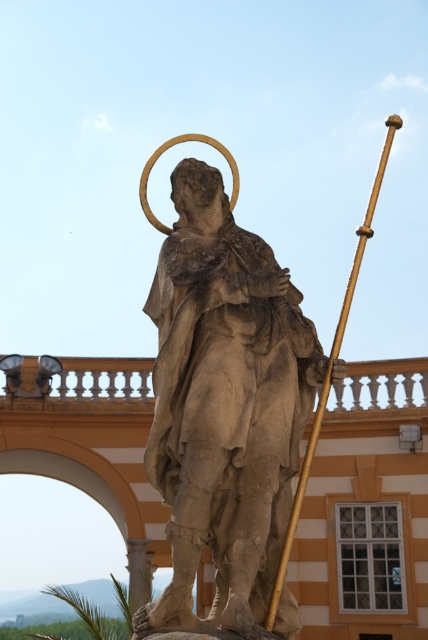
Question: Which point is closer to the camera taking this photo?

Choices:
 (A) (220, 220)
 (B) (270, 625)

Answer: (B)

Question: Does stone statue at center appear over gold polished staff at center-right?

Choices:
 (A) yes
 (B) no

Answer: (B)

Question: Is stone statue at center smaller than gold polished staff at center-right?

Choices:
 (A) yes
 (B) no

Answer: (A)

Question: Among these points, which one is nearest to the camera?

Choices:
 (A) (175, 589)
 (B) (389, 129)

Answer: (A)

Question: From the image, what is the correct spatial relationship of stone statue at center in relation to gold polished staff at center-right?

Choices:
 (A) below
 (B) above

Answer: (A)